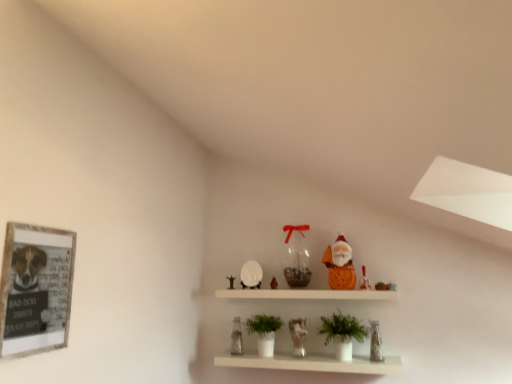
Question: Is white matte shelf at center turned away from orange fabric santa at upper center, which is counted as the fifth toy, starting from the left?

Choices:
 (A) yes
 (B) no

Answer: (B)

Question: Can you confirm if white matte shelf at center is shorter than orange fabric santa at upper center, which is counted as the fifth toy, starting from the left?

Choices:
 (A) yes
 (B) no

Answer: (B)

Question: Is white matte shelf at center bigger than orange fabric santa at upper center, positioned as the third toy in right-to-left order?

Choices:
 (A) yes
 (B) no

Answer: (A)

Question: From a real-world perspective, does white matte shelf at center stand above orange fabric santa at upper center, which is counted as the fifth toy, starting from the left?

Choices:
 (A) no
 (B) yes

Answer: (A)

Question: Is white matte shelf at center beside orange fabric santa at upper center, positioned as the third toy in right-to-left order?

Choices:
 (A) yes
 (B) no

Answer: (B)

Question: Is translucent glass vase at center, the third toy positioned from the left, to the left or to the right of white matte vase at center, the second houseplant viewed from the right, in the image?

Choices:
 (A) right
 (B) left

Answer: (A)

Question: In terms of width, does translucent glass vase at center, the third toy positioned from the left, look wider or thinner when compared to white matte vase at center, positioned as the first houseplant in left-to-right order?

Choices:
 (A) thin
 (B) wide

Answer: (A)

Question: Is point (298, 231) positioned closer to the camera than point (258, 321)?

Choices:
 (A) closer
 (B) farther

Answer: (B)

Question: In terms of height, does translucent glass vase at center, the third toy positioned from the left, look taller or shorter compared to white matte vase at center, positioned as the first houseplant in left-to-right order?

Choices:
 (A) tall
 (B) short

Answer: (A)

Question: Is white matte vase at center, positioned as the first houseplant in left-to-right order, inside or outside of clear glass vase at lower center, placed as the 1th toy when sorted from left to right?

Choices:
 (A) inside
 (B) outside

Answer: (B)

Question: Does point (281, 322) appear closer or farther from the camera than point (238, 347)?

Choices:
 (A) closer
 (B) farther

Answer: (A)

Question: Considering the positions of white matte vase at center, positioned as the first houseplant in left-to-right order, and clear glass vase at lower center, placed as the 1th toy when sorted from left to right, in the image, is white matte vase at center, positioned as the first houseplant in left-to-right order, wider or thinner than clear glass vase at lower center, placed as the 1th toy when sorted from left to right,?

Choices:
 (A) wide
 (B) thin

Answer: (A)

Question: Is white matte vase at center, positioned as the first houseplant in left-to-right order, bigger or smaller than clear glass vase at lower center, positioned as the 7th toy in right-to-left order?

Choices:
 (A) big
 (B) small

Answer: (A)

Question: Is matte orange santa at upper center, positioned as the sixth toy in left-to-right order, in front of or behind white matte shelf at center in the image?

Choices:
 (A) behind
 (B) front

Answer: (A)

Question: From the image's perspective, is matte orange santa at upper center, positioned as the sixth toy in left-to-right order, above or below white matte shelf at center?

Choices:
 (A) below
 (B) above

Answer: (B)